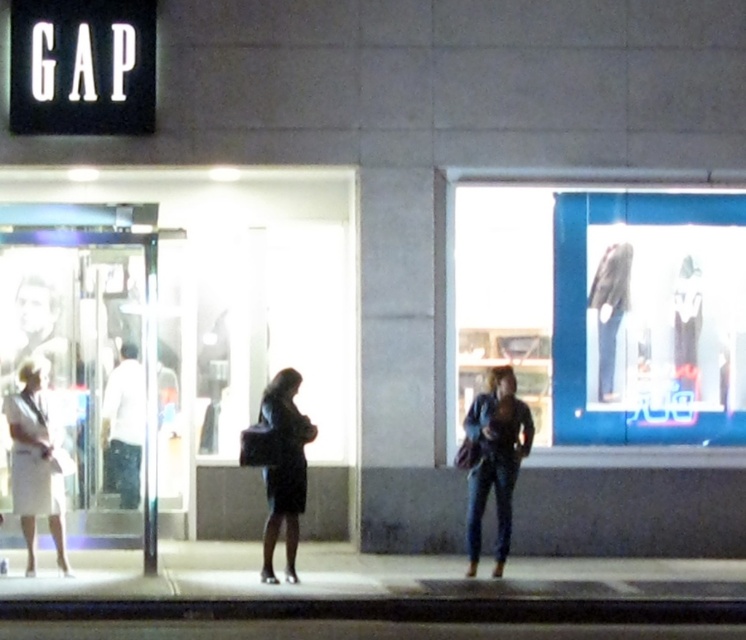
Which is in front, point (677, 234) or point (47, 496)?

Point (47, 496) is more forward.

Which of these two, blue glass display at center or white matte skirt at left, stands taller?

With more height is blue glass display at center.

Is point (645, 291) less distant than point (54, 432)?

No, (645, 291) is further to viewer.

Locate an element on the screen. This screenshot has height=640, width=746. blue glass display at center is located at coordinates (606, 310).

What are the coordinates of `denim jeans at center` in the screenshot? It's located at (495, 458).

Which is behind, point (510, 435) or point (266, 417)?

The point (510, 435) is more distant.

Locate an element on the screen. denim jeans at center is located at coordinates (495, 458).

Who is more forward, (571, 419) or (492, 438)?

Point (492, 438)

Can you confirm if blue glass display at center is positioned above denim jeans at center?

Correct, blue glass display at center is located above denim jeans at center.

The image size is (746, 640). What do you see at coordinates (606, 310) in the screenshot?
I see `blue glass display at center` at bounding box center [606, 310].

At what (x,y) coordinates should I click in order to perform the action: click on blue glass display at center. Please return your answer as a coordinate pair (x, y). The image size is (746, 640). Looking at the image, I should click on pyautogui.click(x=606, y=310).